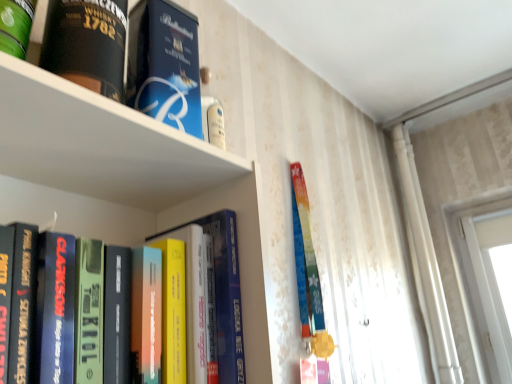
Question: Looking at the image, does green matte canister at upper left, which is counted as the 4th book, starting from the bottom, seem bigger or smaller compared to hardcover book at left, arranged as the fourth book when viewed from the top?

Choices:
 (A) big
 (B) small

Answer: (B)

Question: Does point (0, 23) appear closer or farther from the camera than point (44, 317)?

Choices:
 (A) farther
 (B) closer

Answer: (A)

Question: Which is farther from the black matte whiskey bottle at upper left, which is counted as the second book, starting from the top?

Choices:
 (A) blue cardboard box at upper center, positioned as the second book in bottom-to-top order
 (B) hardcover book at left, marked as the first book in a bottom-to-top arrangement
 (C) green matte canister at upper left, which appears as the 1th book when viewed from the top

Answer: (B)

Question: Which object is the closest to the hardcover book at left, marked as the first book in a bottom-to-top arrangement?

Choices:
 (A) black matte whiskey bottle at upper left, which is the 3th book from bottom to top
 (B) green matte canister at upper left, which appears as the 1th book when viewed from the top
 (C) blue cardboard box at upper center, placed as the third book when sorted from top to bottom

Answer: (C)